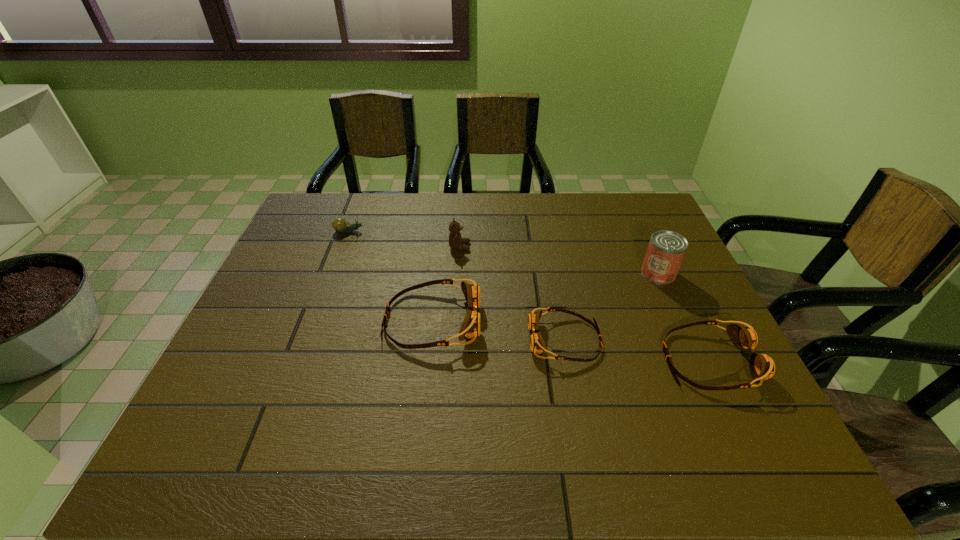
Identify the location of object that is at the left edge. (340, 225).

You are a GUI agent. You are given a task and a screenshot of the screen. Output one action in this format:
    pyautogui.click(x=<x>, y=<y>)
    Task: Click on the goggles present at the right edge
    
    Given the screenshot: What is the action you would take?
    pyautogui.click(x=762, y=367)

The height and width of the screenshot is (540, 960). I want to click on can situated at the right edge, so click(666, 250).

Locate an element on the screen. This screenshot has height=540, width=960. object located at the far left corner is located at coordinates (340, 225).

Where is `object positioned at the near right corner`? Image resolution: width=960 pixels, height=540 pixels. object positioned at the near right corner is located at coordinates [x=762, y=367].

Find the location of a particular element. Image resolution: width=960 pixels, height=540 pixels. vacant space at the far edge of the desktop is located at coordinates (430, 207).

Identify the location of blank space at the near edge. This screenshot has height=540, width=960. coord(354,399).

You are a GUI agent. You are given a task and a screenshot of the screen. Output one action in this format:
    pyautogui.click(x=<x>, y=<y>)
    Task: Click on the vacant area at the left edge
    This screenshot has width=960, height=540.
    Given the screenshot: What is the action you would take?
    [277, 293]

Image resolution: width=960 pixels, height=540 pixels. In the image, there is a desktop. What are the coordinates of `free space at the right edge` in the screenshot? It's located at (691, 345).

Identify the location of vacant area at the far left corner of the desktop. (307, 212).